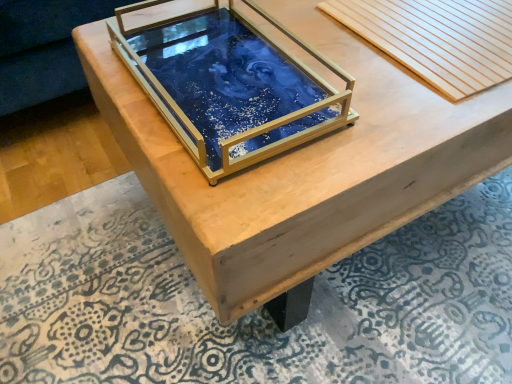
Question: Is wooden slats at upper right situated inside blue resin tray at center or outside?

Choices:
 (A) inside
 (B) outside

Answer: (B)

Question: Visually, is wooden slats at upper right positioned to the left or to the right of blue resin tray at center?

Choices:
 (A) right
 (B) left

Answer: (A)

Question: Which of these objects is positioned closest to the blue resin tray at center?

Choices:
 (A) wooden table at center
 (B) wooden slats at upper right
 (C) blue resin tray at center

Answer: (A)

Question: Estimate the real-world distances between objects in this image. Which object is farther from the wooden table at center?

Choices:
 (A) blue resin tray at center
 (B) wooden slats at upper right
 (C) blue resin tray at center

Answer: (A)